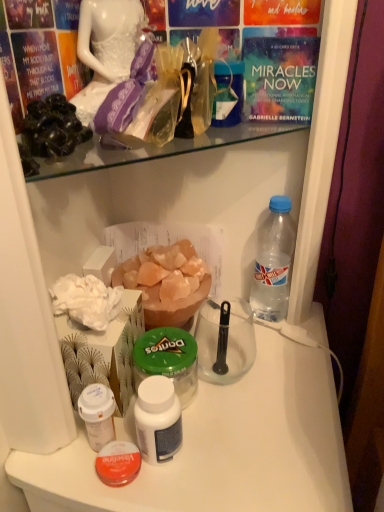
You are a GUI agent. You are given a task and a screenshot of the screen. Output one action in this format:
    pyautogui.click(x=<x>, y=<y>)
    Task: Click on the vacant area that is situated to the right of white plastic bottle at center, which is the second bottle from left to right
    The width and height of the screenshot is (384, 512).
    Given the screenshot: What is the action you would take?
    pyautogui.click(x=257, y=434)